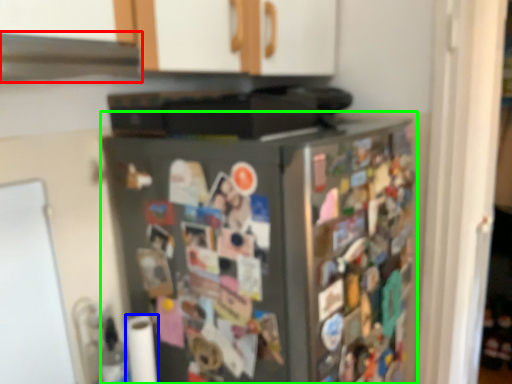
Question: Which object is the farthest from exhaust hood (highlighted by a red box)? Choose among these: toilet paper (highlighted by a blue box) or refrigerator (highlighted by a green box).

Choices:
 (A) toilet paper
 (B) refrigerator

Answer: (A)